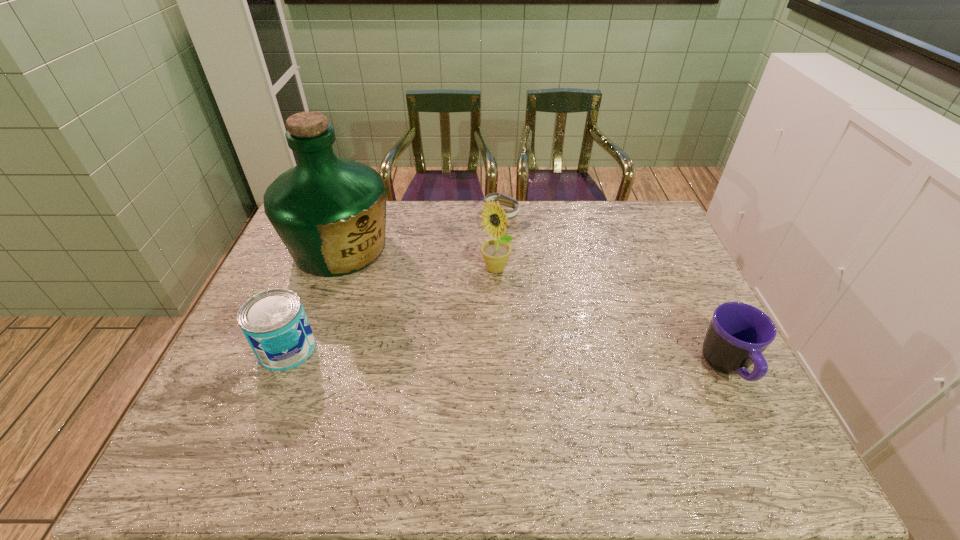
You are a GUI agent. You are given a task and a screenshot of the screen. Output one action in this format:
    pyautogui.click(x=<x>, y=<y>)
    Task: Click on the free space on the desktop that is between the can and the mug and is positioned on the face of the fourth shortest object
    
    Given the screenshot: What is the action you would take?
    pyautogui.click(x=468, y=356)

In order to click on vacant space on the desktop that is between the can and the rightmost object and is positioned on the face of the watch in this screenshot , I will do `click(569, 361)`.

Locate an element on the screen. Image resolution: width=960 pixels, height=540 pixels. vacant space on the desktop that is between the can and the rightmost object and is positioned on the label side of the tallest object is located at coordinates (462, 356).